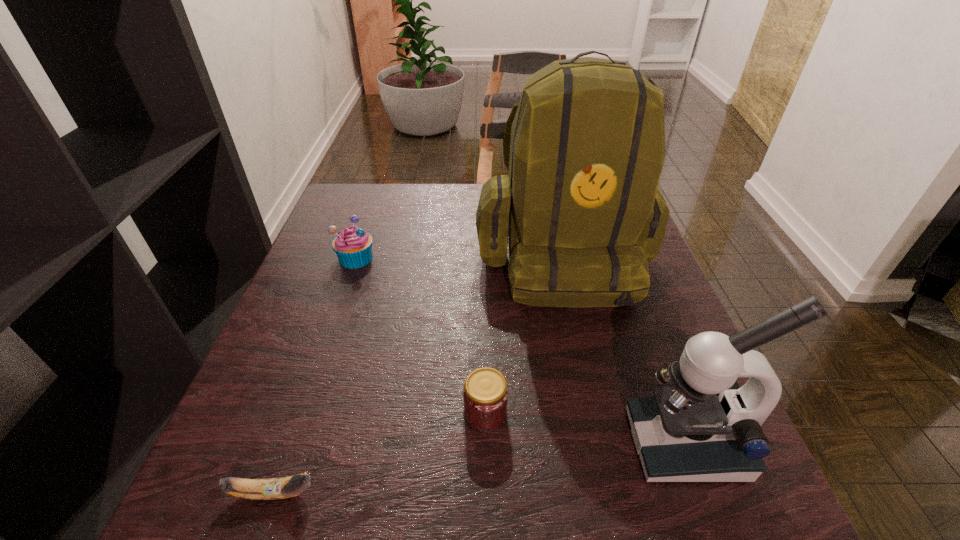
Where is `the tallest object`? the tallest object is located at coordinates (581, 213).

Find the location of a particular element. This screenshot has width=960, height=540. microscope is located at coordinates (705, 428).

At what (x,y) coordinates should I click in order to perform the action: click on muffin. Please return your answer as a coordinate pair (x, y). The image size is (960, 540). Looking at the image, I should click on (353, 245).

Identify the location of jam. [485, 393].

Identify the location of banana. (274, 488).

Image resolution: width=960 pixels, height=540 pixels. In order to click on vacant space located on the front-facing side of the tallest object in this screenshot , I will do `click(582, 344)`.

At what (x,y) coordinates should I click in order to perform the action: click on free space located 0.200m on the left of the microscope. Please return your answer as a coordinate pair (x, y). Looking at the image, I should click on (510, 443).

Locate an element on the screen. The width and height of the screenshot is (960, 540). free space located 0.060m on the right of the third tallest object is located at coordinates (400, 258).

The height and width of the screenshot is (540, 960). In order to click on vacant space located 0.240m on the left of the jam in this screenshot , I will do `click(324, 413)`.

Find the location of a particular element. The image size is (960, 540). vacant region located on the peel of the banana is located at coordinates (555, 493).